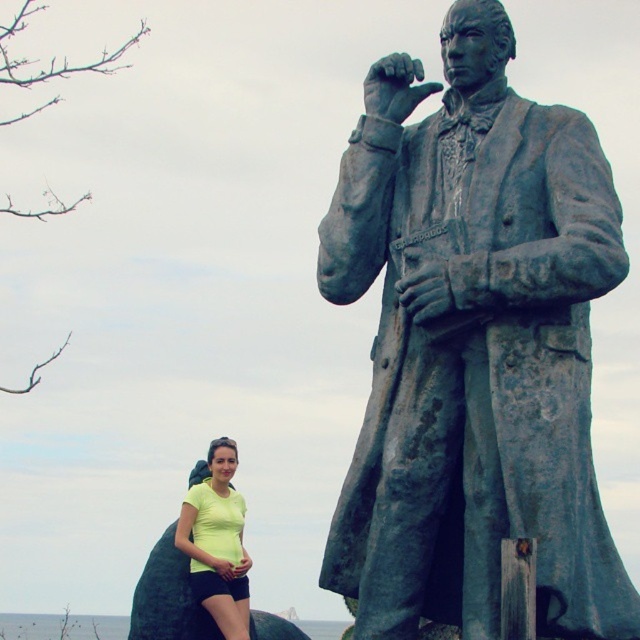
You are a photographer trying to capture a photo of the bronze statue at right and the yellow matte shirt at lower left. Based on their positions, which object should you adjust your camera angle to focus on first if you want to include both in the frame?

The bronze statue at right is to the right of the yellow matte shirt at lower left, so you should first focus on the yellow matte shirt at lower left to ensure both are in frame.

You are a photographer trying to capture a photo of the bronze statue at right and the yellow matte shirt at lower left. Which object should you focus on first if you want to ensure both are in sharp focus?

You should focus on the bronze statue at right first because it is closer to the viewer than the yellow matte shirt at lower left, so focusing on the closer object will ensure both are in focus.

You are standing at the point marked by coordinates point (474, 348). What object are you standing next to?

You are standing next to the bronze statue at right because the point (474, 348) corresponds to it.